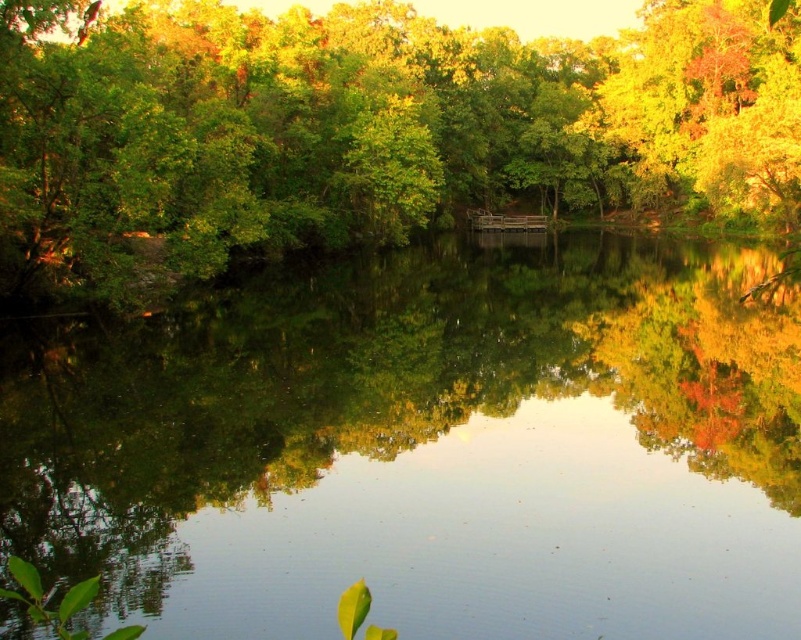
Does clear water at center have a greater height compared to green leafy tree at center?

Incorrect, clear water at center's height is not larger of green leafy tree at center's.

Is clear water at center positioned before green leafy tree at center?

No, clear water at center is further to the viewer.

Image resolution: width=801 pixels, height=640 pixels. I want to click on clear water at center, so click(425, 448).

This screenshot has width=801, height=640. What are the coordinates of `clear water at center` in the screenshot? It's located at (425, 448).